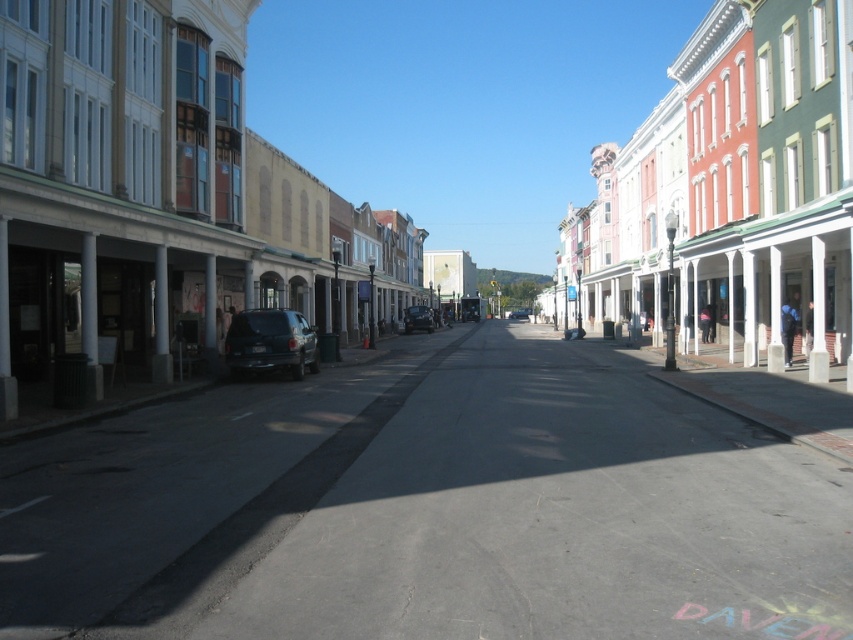
You are a delivery driver who needs to park your truck between the red brick building at center and the shiny black car at center. Your truck is 40 feet long. Is there enough space between them for your truck?

The distance between the red brick building at center and the shiny black car at center is 79.01 feet. Since your truck is only 40 feet long, there is sufficient space between them for your truck to park.

You are standing at point A, which is located at coordinates (732,193). Looking around, you see a red brick building at center. Which direction should you face to see the red brick building at center?

You should face towards the center direction to see the red brick building at center located at point A.

You are driving a delivery truck and need to pass through the street where the shiny black car at center and the matte black van at center are parked. Can you safely navigate around them without moving either vehicle?

The shiny black car at center is in front of the matte black van at center, so you can drive around the matte black van at center by going around the shiny black car at center first since it is closer to you.